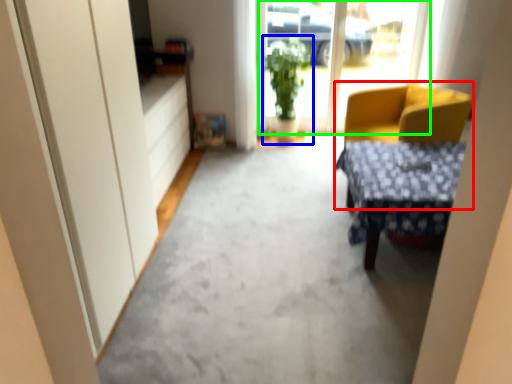
Question: Which is farther away from chair (highlighted by a red box)? houseplant (highlighted by a blue box) or window screen (highlighted by a green box)?

Choices:
 (A) houseplant
 (B) window screen

Answer: (B)